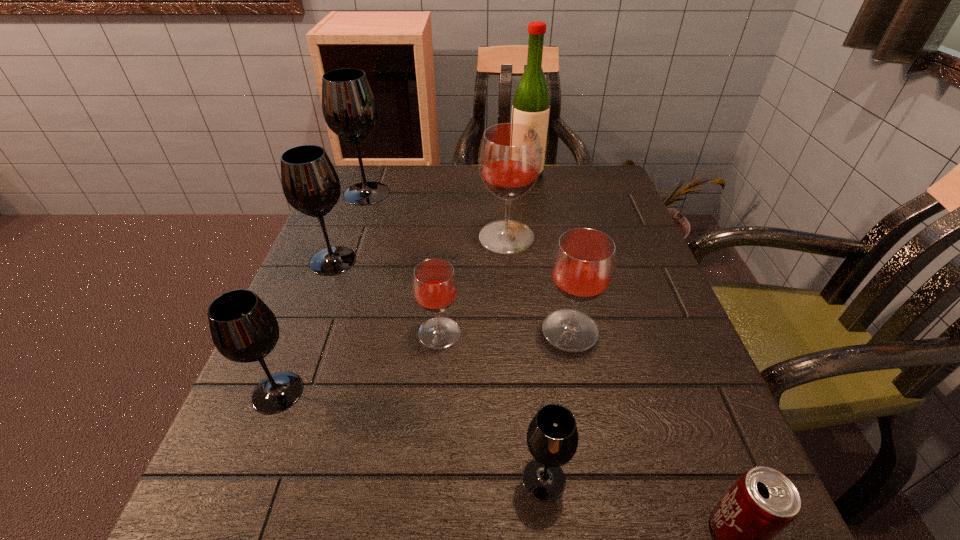
What are the coordinates of `the tallest object` in the screenshot? It's located at (531, 104).

I want to click on liquor, so click(531, 104).

At what (x,y) coordinates should I click in order to perform the action: click on the farthest wineglass. Please return your answer as a coordinate pair (x, y). This screenshot has height=540, width=960. Looking at the image, I should click on (350, 109).

Where is `the biggest gray wineglass`? Image resolution: width=960 pixels, height=540 pixels. the biggest gray wineglass is located at coordinates (350, 109).

This screenshot has width=960, height=540. I want to click on the biggest red wineglass, so click(510, 155).

The image size is (960, 540). I want to click on the second farthest gray wineglass, so [x=310, y=183].

Identify the location of the second smallest red wineglass. (583, 265).

What are the coordinates of `the third farthest gray wineglass` in the screenshot? It's located at (243, 328).

Identify the location of the second smallest gray wineglass. The width and height of the screenshot is (960, 540). (243, 328).

Identify the location of the sixth object from right to left. (435, 287).